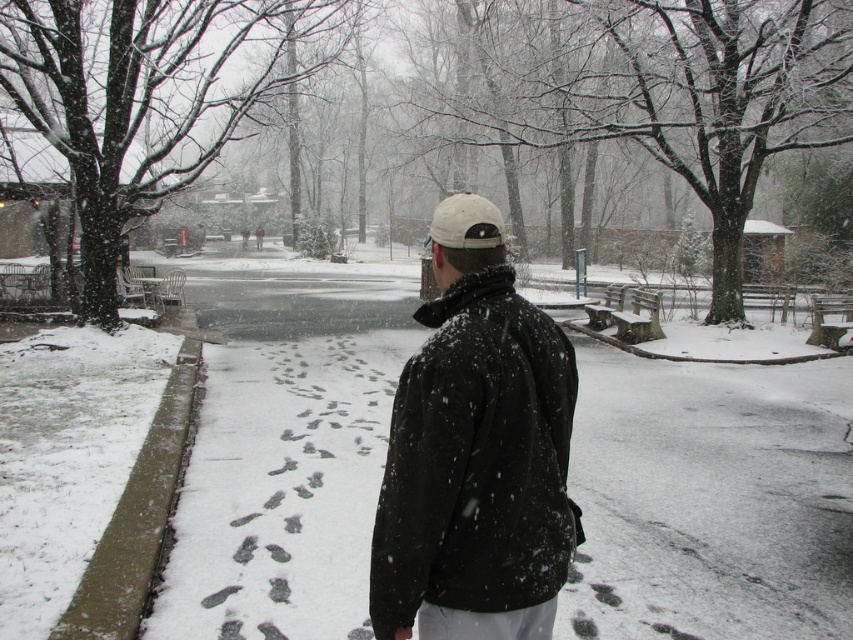
Can you confirm if black matte jacket at center is positioned to the right of white matte baseball hat at center?

No, black matte jacket at center is not to the right of white matte baseball hat at center.

Who is more forward, (386,513) or (485,204)?

Point (386,513) is more forward.

Image resolution: width=853 pixels, height=640 pixels. Find the location of `black matte jacket at center`. black matte jacket at center is located at coordinates (476, 465).